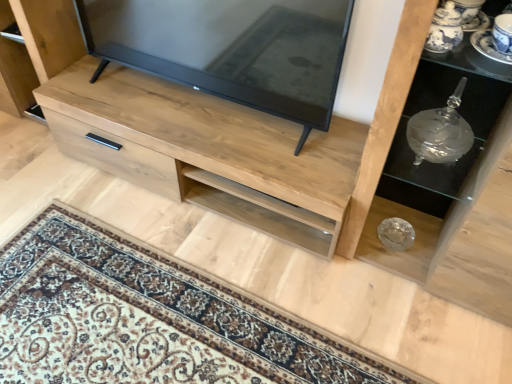
You are a GUI agent. You are given a task and a screenshot of the screen. Output one action in this format:
    pyautogui.click(x=<x>, y=<y>)
    Task: Click on the matte black tv at center
    The height and width of the screenshot is (384, 512).
    Given the screenshot: What is the action you would take?
    pyautogui.click(x=230, y=48)

What is the approximate width of natural wood chest of drawers at center?

natural wood chest of drawers at center is 17.55 inches wide.

The image size is (512, 384). I want to click on matte black tv at center, so pos(230,48).

Measure the distance from natural wood chest of drawers at center to transparent glass vase at right, the 1th shelf viewed from the back.

A distance of 20.56 inches exists between natural wood chest of drawers at center and transparent glass vase at right, the 1th shelf viewed from the back.

Is natural wood chest of drawers at center further to the viewer compared to transparent glass vase at right, the second shelf in the front-to-back sequence?

That is True.

From a real-world perspective, is natural wood chest of drawers at center located higher than transparent glass vase at right, the second shelf in the front-to-back sequence?

Incorrect, from a real-world perspective, natural wood chest of drawers at center is lower than transparent glass vase at right, the second shelf in the front-to-back sequence.

Considering the sizes of natural wood chest of drawers at center and transparent glass vase at right, the second shelf in the front-to-back sequence, in the image, is natural wood chest of drawers at center taller or shorter than transparent glass vase at right, the second shelf in the front-to-back sequence,?

Clearly, natural wood chest of drawers at center is taller compared to transparent glass vase at right, the second shelf in the front-to-back sequence.

Is natural wood chest of drawers at center oriented towards blue and white porcelain saucer at upper right?

No.

From a real-world perspective, is natural wood chest of drawers at center positioned above or below blue and white porcelain saucer at upper right?

Clearly, from a real-world perspective, natural wood chest of drawers at center is below blue and white porcelain saucer at upper right.

Considering the positions of objects natural wood chest of drawers at center and blue and white porcelain saucer at upper right in the image provided, who is more to the right, natural wood chest of drawers at center or blue and white porcelain saucer at upper right?

blue and white porcelain saucer at upper right.

Between natural wood chest of drawers at center and blue and white porcelain saucer at upper right, which one has larger width?

Wider between the two is natural wood chest of drawers at center.

In terms of width, does matte black tv at center look wider or thinner when compared to transparent glass vase at right, the 1th shelf viewed from the back?

In the image, matte black tv at center appears to be more narrow than transparent glass vase at right, the 1th shelf viewed from the back.

Could you measure the distance between matte black tv at center and transparent glass vase at right, the second shelf in the front-to-back sequence?

20.63 inches.

In the scene shown: Does matte black tv at center turn towards transparent glass vase at right, the second shelf in the front-to-back sequence?

No, matte black tv at center is not turned towards transparent glass vase at right, the second shelf in the front-to-back sequence.

Which is closer to the camera, [174,73] or [435,197]?

The point [174,73] is closer to the camera.

Which point is more distant from viewer, (474, 129) or (134, 99)?

Positioned behind is point (134, 99).

In the image, is transparent glass vase at right, the 1th shelf viewed from the back, on the left side or the right side of natural wood chest of drawers at center?

Clearly, transparent glass vase at right, the 1th shelf viewed from the back, is on the right of natural wood chest of drawers at center in the image.

Is transparent glass vase at right, the second shelf in the front-to-back sequence, spatially inside natural wood chest of drawers at center, or outside of it?

transparent glass vase at right, the second shelf in the front-to-back sequence, is outside natural wood chest of drawers at center.

Is natural wood chest of drawers at center at the back of transparent glass vase at right, the second shelf in the front-to-back sequence?

No, transparent glass vase at right, the second shelf in the front-to-back sequence, is not facing away from natural wood chest of drawers at center.

Does point (166, 147) come farther from viewer compared to point (172, 49)?

No, it is not.

Where is `chest of drawers below the matte black tv at center (from a real-world perspective)`? This screenshot has width=512, height=384. chest of drawers below the matte black tv at center (from a real-world perspective) is located at coordinates (208, 151).

From a real-world perspective, is blue and white porcelain saucer at upper right physically located above or below clear glass bowl at center, the 1th shelf when ordered from front to back?

In terms of real-world spatial position, blue and white porcelain saucer at upper right is above clear glass bowl at center, the 1th shelf when ordered from front to back.

Measure the distance between blue and white porcelain saucer at upper right and clear glass bowl at center, the 1th shelf when ordered from front to back.

blue and white porcelain saucer at upper right and clear glass bowl at center, the 1th shelf when ordered from front to back, are 16.34 inches apart.

Is point (492, 56) closer to viewer compared to point (423, 89)?

Yes, it is in front of point (423, 89).

Locate an element on the screen. saucer above the clear glass bowl at center, which is counted as the second shelf, starting from the back (from the image's perspective) is located at coordinates (488, 47).

Image resolution: width=512 pixels, height=384 pixels. I want to click on saucer on the right of matte black tv at center, so click(488, 47).

Can you tell me how much matte black tv at center and blue and white porcelain saucer at upper right differ in facing direction?

The angle between the facing direction of matte black tv at center and the facing direction of blue and white porcelain saucer at upper right is 1.25 degrees.

From a real-world perspective, which object stands above the other?

In real-world perspective, blue and white porcelain saucer at upper right is above.

Is matte black tv at center far away from blue and white porcelain saucer at upper right?

They are positioned close to each other.

In order to click on the chest of drawers directly beneath the transparent glass vase at right, the 1th shelf viewed from the back (from a real-world perspective) in this screenshot , I will do `click(208, 151)`.

Where is `chest of drawers that is on the left side of blue and white porcelain saucer at upper right`? This screenshot has width=512, height=384. chest of drawers that is on the left side of blue and white porcelain saucer at upper right is located at coordinates (208, 151).

Considering their positions, is natural wood chest of drawers at center positioned further to transparent glass vase at right, the second shelf in the front-to-back sequence, than matte black tv at center?

The object further to transparent glass vase at right, the second shelf in the front-to-back sequence, is matte black tv at center.

Based on the photo, based on their spatial positions, is blue and white porcelain saucer at upper right or natural wood chest of drawers at center closer to clear glass bowl at center, the 1th shelf when ordered from front to back?

Among the two, blue and white porcelain saucer at upper right is located nearer to clear glass bowl at center, the 1th shelf when ordered from front to back.

When comparing their distances from natural wood chest of drawers at center, does clear glass bowl at center, the 1th shelf when ordered from front to back, or transparent glass vase at right, the 1th shelf viewed from the back, seem closer?

clear glass bowl at center, the 1th shelf when ordered from front to back, lies closer to natural wood chest of drawers at center than the other object.

Looking at the image, which one is located closer to transparent glass vase at right, the 1th shelf viewed from the back, natural wood chest of drawers at center or clear glass bowl at center, which is counted as the second shelf, starting from the back?

Among the two, clear glass bowl at center, which is counted as the second shelf, starting from the back, is located nearer to transparent glass vase at right, the 1th shelf viewed from the back.

From the picture: Based on their spatial positions, is blue and white porcelain saucer at upper right or natural wood chest of drawers at center closer to transparent glass vase at right, the second shelf in the front-to-back sequence?

Based on the image, blue and white porcelain saucer at upper right appears to be nearer to transparent glass vase at right, the second shelf in the front-to-back sequence.

From the image, which object appears to be nearer to blue and white porcelain saucer at upper right, matte black tv at center or clear glass bowl at center, which is counted as the second shelf, starting from the back?

The object closer to blue and white porcelain saucer at upper right is clear glass bowl at center, which is counted as the second shelf, starting from the back.

From the image, which object appears to be nearer to clear glass bowl at center, which is counted as the second shelf, starting from the back, matte black tv at center or transparent glass vase at right, the second shelf in the front-to-back sequence?

transparent glass vase at right, the second shelf in the front-to-back sequence, is positioned closer to the anchor clear glass bowl at center, which is counted as the second shelf, starting from the back.

Based on their spatial positions, is blue and white porcelain saucer at upper right or matte black tv at center closer to natural wood chest of drawers at center?

The object closer to natural wood chest of drawers at center is matte black tv at center.

I want to click on saucer situated between matte black tv at center and clear glass bowl at center, the 1th shelf when ordered from front to back, from left to right, so click(x=488, y=47).

Locate an element on the screen. This screenshot has width=512, height=384. saucer positioned between clear glass bowl at center, which is counted as the second shelf, starting from the back, and transparent glass vase at right, the 1th shelf viewed from the back, from near to far is located at coordinates (488, 47).

Find the location of `television situated between natural wood chest of drawers at center and blue and white porcelain saucer at upper right from left to right`. television situated between natural wood chest of drawers at center and blue and white porcelain saucer at upper right from left to right is located at coordinates (x=230, y=48).

I want to click on shelf between natural wood chest of drawers at center and clear glass bowl at center, which is counted as the second shelf, starting from the back, from left to right, so pyautogui.click(x=440, y=164).